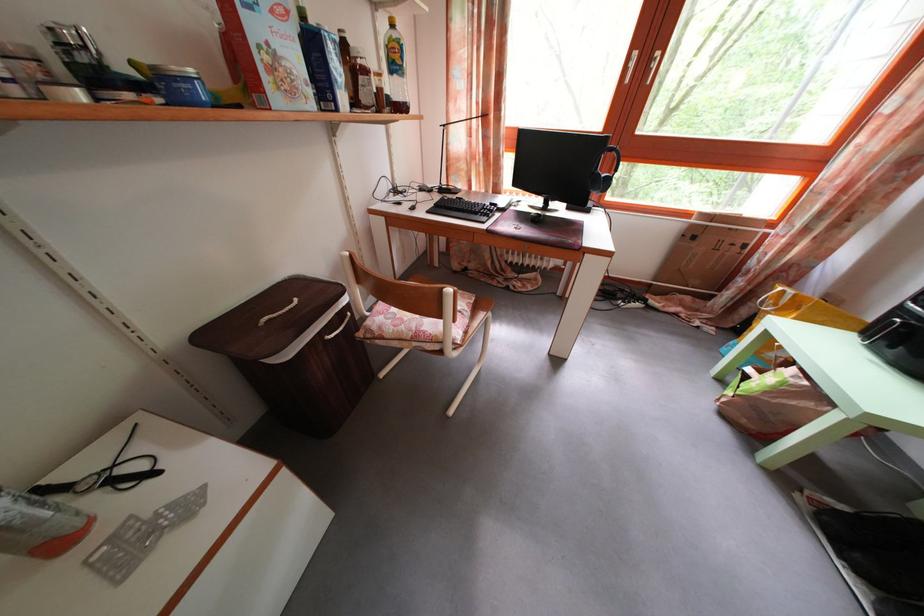
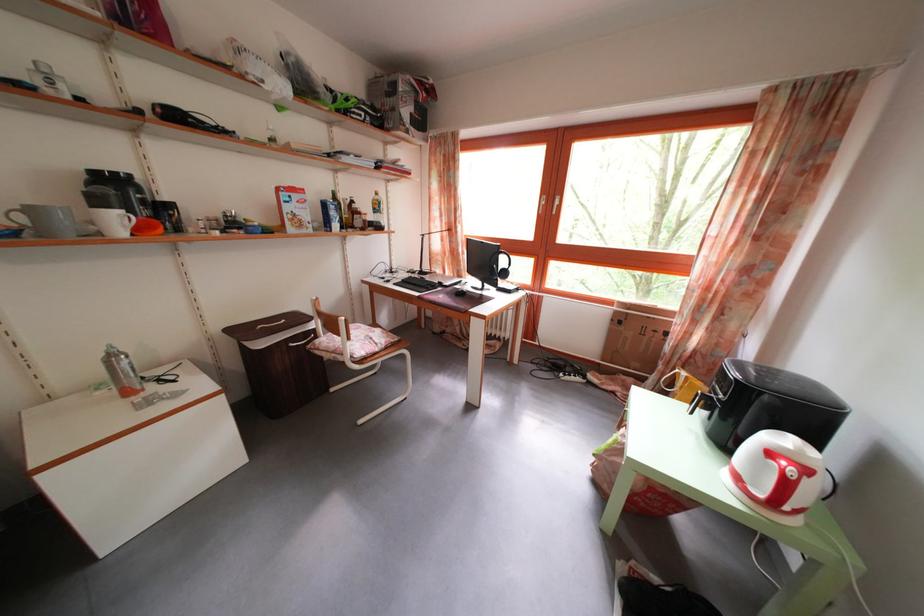
Find the pixel in the second image that matches [355,314] in the first image.

(322, 339)